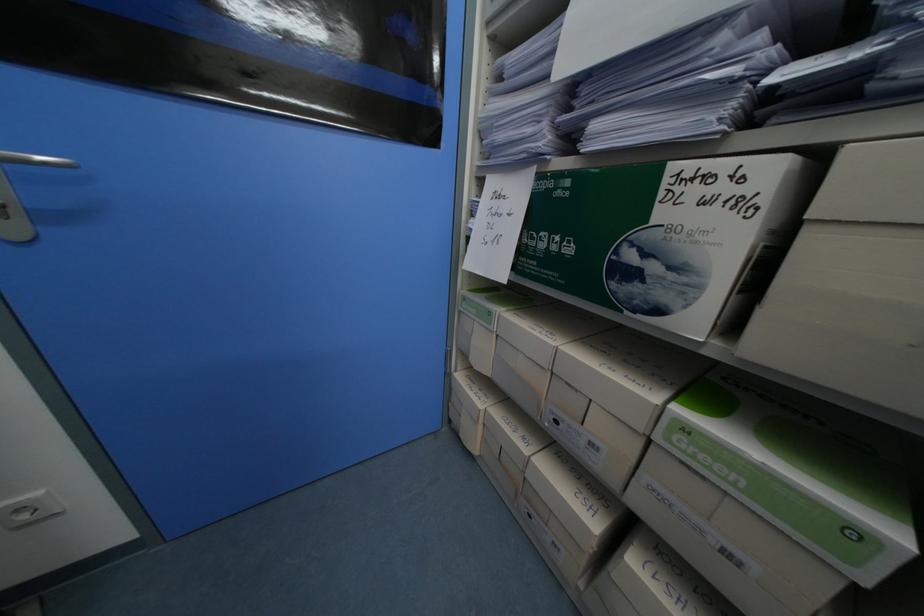
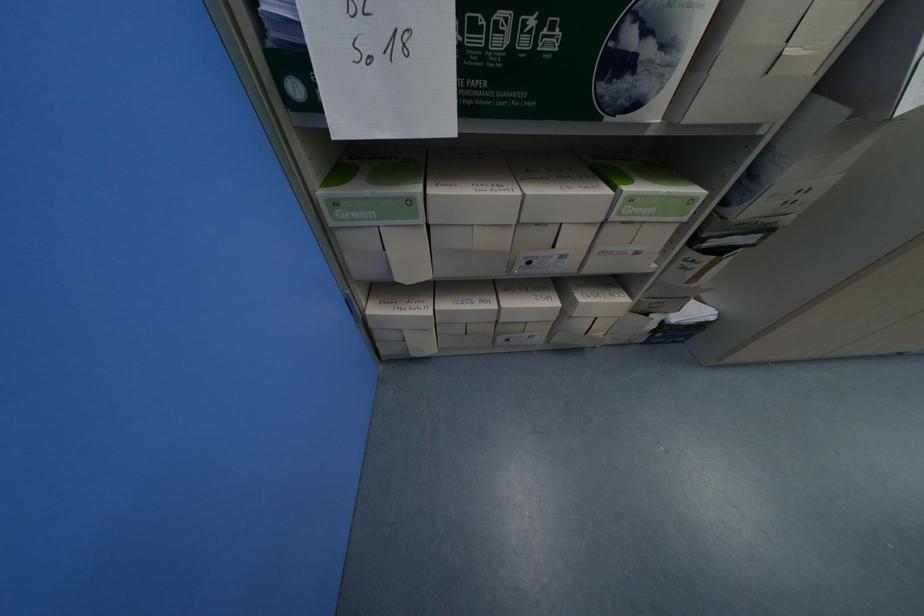
Locate, in the second image, the point that corresponds to (x=531, y=452) in the first image.

(500, 307)